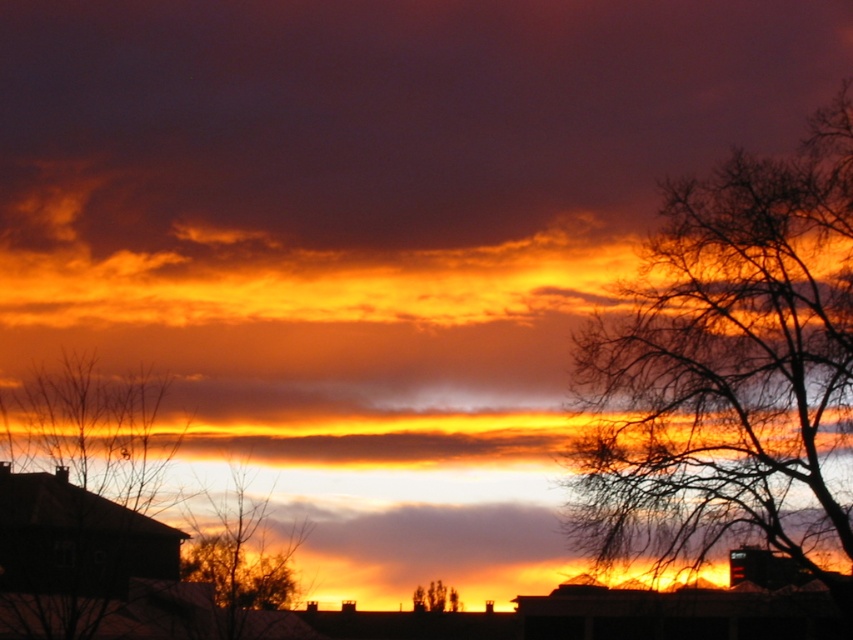
Question: Among these points, which one is nearest to the camera?

Choices:
 (A) (421, 588)
 (B) (828, 212)
 (C) (1, 620)

Answer: (C)

Question: Does silhouette bare tree at left have a larger size compared to silhouette bare tree at center?

Choices:
 (A) yes
 (B) no

Answer: (A)

Question: Which object appears farthest from the camera in this image?

Choices:
 (A) silhouette bare tree at left
 (B) silhouette bare tree at center
 (C) bare branches at upper right
 (D) silhouette leafless tree at center

Answer: (D)

Question: Does bare branches at upper right have a lesser width compared to silhouette bare tree at left?

Choices:
 (A) yes
 (B) no

Answer: (A)

Question: Where is silhouette bare tree at left located in relation to silhouette bare tree at center in the image?

Choices:
 (A) below
 (B) above

Answer: (B)

Question: Based on their relative distances, which object is farther from the silhouette leafless tree at center?

Choices:
 (A) silhouette bare tree at left
 (B) silhouette bare tree at center
 (C) bare branches at upper right

Answer: (C)